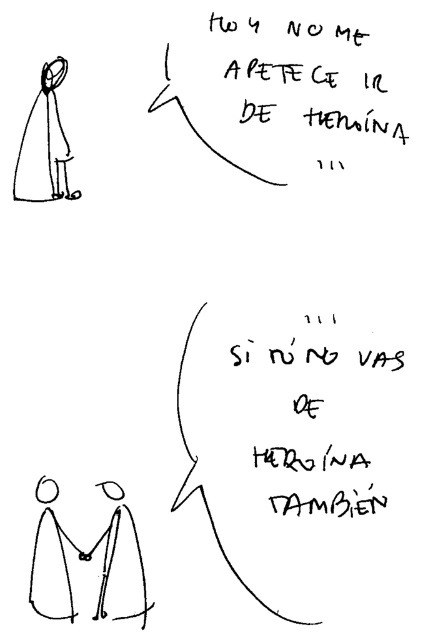
You are an art student analyzing a sketch. You notice two figures in the image. One is the smooth black figures at center and the other is the black line drawing figure at upper left. Based on the drawing, which figure is wider?

The smooth black figures at center is wider than the black line drawing figure at upper left because its width is larger.

You are an art student analyzing a sketch. You notice two figures in the image. The first is a black line drawing figure at upper left, and the second is a smooth black figures at center. Based on their sizes, which figure would appear closer to the viewer?

The smooth black figures at center is shorter than the black line drawing figure at upper left, so the black line drawing figure at upper left appears closer to the viewer since it is larger in size.